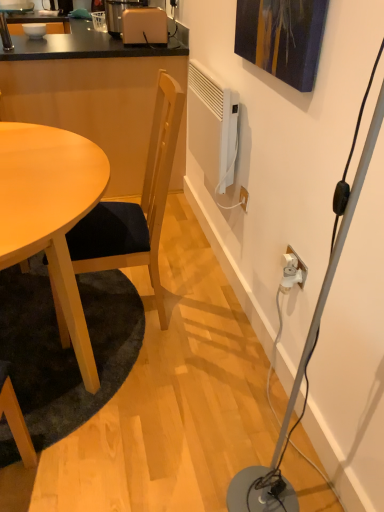
Question: Does light brown wooden table at lower left have a lesser width compared to beige plastic coffee machine at upper center?

Choices:
 (A) no
 (B) yes

Answer: (A)

Question: Is the position of light brown wooden table at lower left less distant than that of beige plastic coffee machine at upper center?

Choices:
 (A) no
 (B) yes

Answer: (B)

Question: Considering the relative sizes of light brown wooden table at lower left and beige plastic coffee machine at upper center in the image provided, is light brown wooden table at lower left bigger than beige plastic coffee machine at upper center?

Choices:
 (A) no
 (B) yes

Answer: (A)

Question: Is beige plastic coffee machine at upper center a part of light brown wooden table at lower left?

Choices:
 (A) yes
 (B) no

Answer: (B)

Question: Is light brown wooden table at lower left further to camera compared to beige plastic coffee machine at upper center?

Choices:
 (A) yes
 (B) no

Answer: (B)

Question: Is point (324, 289) closer or farther from the camera than point (79, 312)?

Choices:
 (A) farther
 (B) closer

Answer: (B)

Question: In the image, is white plastic lamp at lower right positioned in front of or behind light wood table at left?

Choices:
 (A) front
 (B) behind

Answer: (A)

Question: From their relative heights in the image, would you say white plastic lamp at lower right is taller or shorter than light wood table at left?

Choices:
 (A) tall
 (B) short

Answer: (A)

Question: From a real-world perspective, is white plastic lamp at lower right positioned above or below light wood table at left?

Choices:
 (A) above
 (B) below

Answer: (A)

Question: Is beige plastic coffee machine at upper center to the left or to the right of white plastic plug at lower right, the 2th plug viewed from the front, in the image?

Choices:
 (A) right
 (B) left

Answer: (B)

Question: Considering the positions of beige plastic coffee machine at upper center and white plastic plug at lower right, the 2th plug viewed from the front, in the image, is beige plastic coffee machine at upper center taller or shorter than white plastic plug at lower right, the 2th plug viewed from the front,?

Choices:
 (A) tall
 (B) short

Answer: (A)

Question: Is beige plastic coffee machine at upper center inside the boundaries of white plastic plug at lower right, the 2th plug viewed from the front, or outside?

Choices:
 (A) outside
 (B) inside

Answer: (A)

Question: Looking at their shapes, would you say beige plastic coffee machine at upper center is wider or thinner than white plastic plug at lower right, the 2th plug viewed from the front?

Choices:
 (A) wide
 (B) thin

Answer: (A)

Question: From the image's perspective, is wooden chair at center positioned above or below white plastic plug at lower right, marked as the 1th plug in a back-to-front arrangement?

Choices:
 (A) above
 (B) below

Answer: (A)

Question: From their relative heights in the image, would you say wooden chair at center is taller or shorter than white plastic plug at lower right, the 2th plug viewed from the front?

Choices:
 (A) short
 (B) tall

Answer: (B)